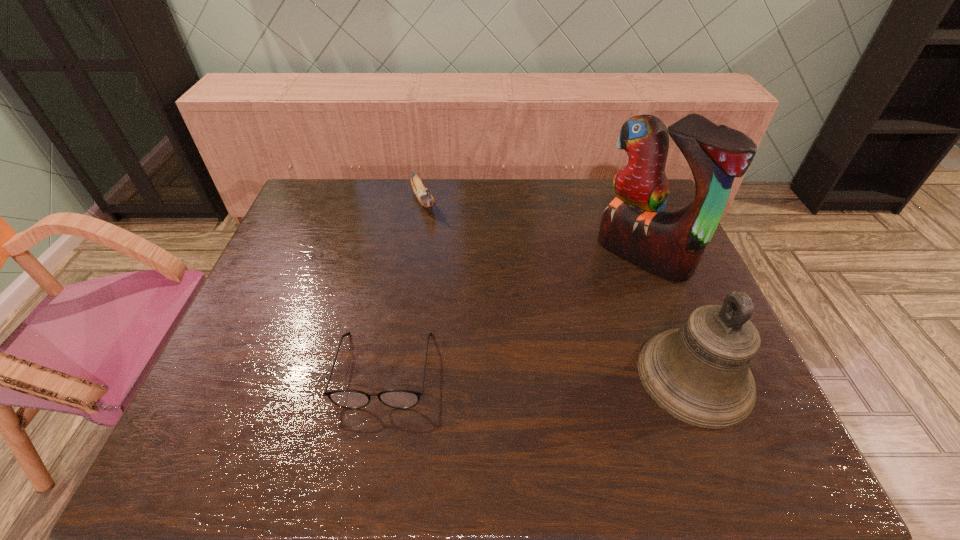
Locate an element on the screen. The height and width of the screenshot is (540, 960). the shortest object is located at coordinates (352, 399).

At what (x,y) coordinates should I click in order to perform the action: click on the third shortest object. Please return your answer as a coordinate pair (x, y). The width and height of the screenshot is (960, 540). Looking at the image, I should click on (699, 373).

You are a GUI agent. You are given a task and a screenshot of the screen. Output one action in this format:
    pyautogui.click(x=<x>, y=<y>)
    Task: Click on the farthest object
    Image resolution: width=960 pixels, height=540 pixels.
    Given the screenshot: What is the action you would take?
    pyautogui.click(x=425, y=199)

The height and width of the screenshot is (540, 960). Identify the location of banana. coord(425,199).

This screenshot has width=960, height=540. Find the location of `the tallest object`. the tallest object is located at coordinates (635, 226).

You are a GUI agent. You are given a task and a screenshot of the screen. Output one action in this format:
    pyautogui.click(x=<x>, y=<y>)
    Task: Click on the parrot
    
    Given the screenshot: What is the action you would take?
    pyautogui.click(x=635, y=226)

Where is `free point located 0.090m on the left of the bell`? free point located 0.090m on the left of the bell is located at coordinates click(599, 376).

Identify the location of free space located 0.260m on the peel of the second shortest object. (451, 269).

Identify the location of blank space located 0.360m on the peel of the second shortest object. The height and width of the screenshot is (540, 960). (463, 294).

You are a GUI agent. You are given a task and a screenshot of the screen. Output one action in this format:
    pyautogui.click(x=<x>, y=<y>)
    Task: Click on the free region located 0.190m on the peel of the second shortest object
    
    Given the screenshot: What is the action you would take?
    coord(444,254)